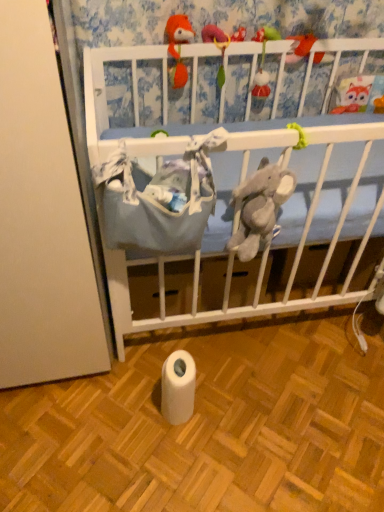
Question: Is blue fabric crib at upper center wider or thinner than fuzzy fabric toy at upper center, marked as the second toy in a right-to-left arrangement?

Choices:
 (A) thin
 (B) wide

Answer: (A)

Question: Is blue fabric crib at upper center taller or shorter than fuzzy fabric toy at upper center, marked as the second toy in a right-to-left arrangement?

Choices:
 (A) short
 (B) tall

Answer: (B)

Question: Which object is positioned farthest from the fluffy orange fox at upper center, the 1th toy from the left?

Choices:
 (A) matte orange plush at upper center, placed as the 1th toy when sorted from right to left
 (B) blue fabric crib at upper center
 (C) white matte toilet paper at lower center
 (D) fuzzy fabric toy at upper center, marked as the second toy in a right-to-left arrangement

Answer: (C)

Question: Estimate the real-world distances between objects in this image. Which object is closer to the white matte toilet paper at lower center?

Choices:
 (A) fuzzy fabric toy at upper center, marked as the 2th toy in a left-to-right arrangement
 (B) fluffy orange fox at upper center, the 1th toy from the left
 (C) blue fabric crib at upper center
 (D) matte orange plush at upper center, placed as the 1th toy when sorted from right to left

Answer: (C)